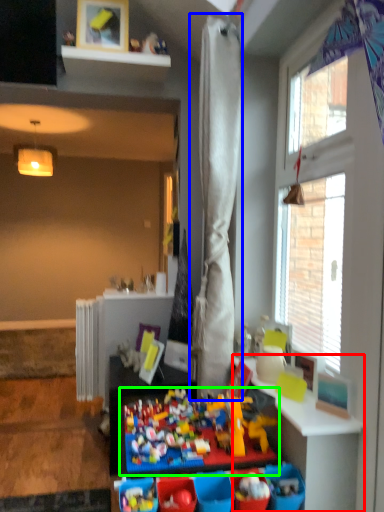
Question: Considering the real-world distances, which object is closest to table (highlighted by a red box)? curtain (highlighted by a blue box) or toy (highlighted by a green box).

Choices:
 (A) curtain
 (B) toy

Answer: (B)